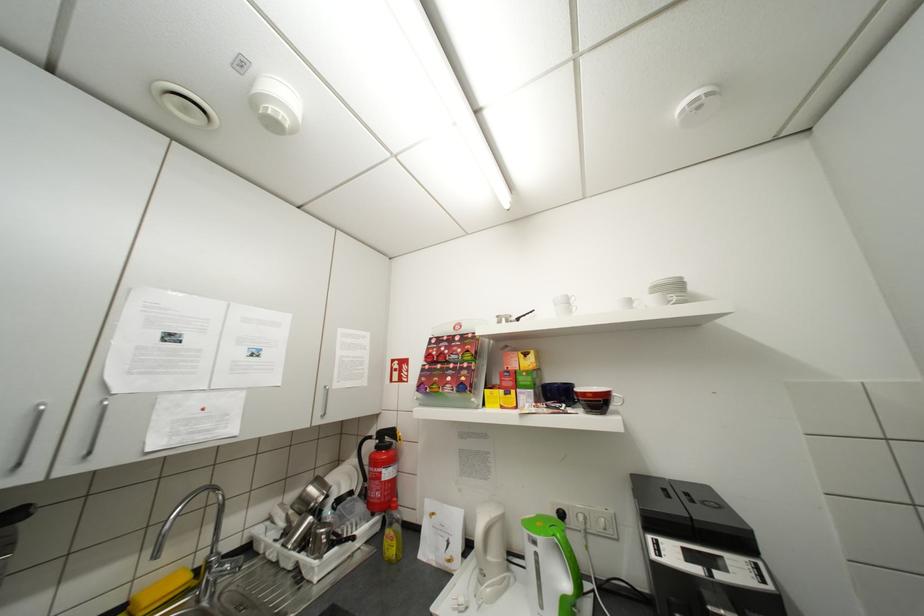
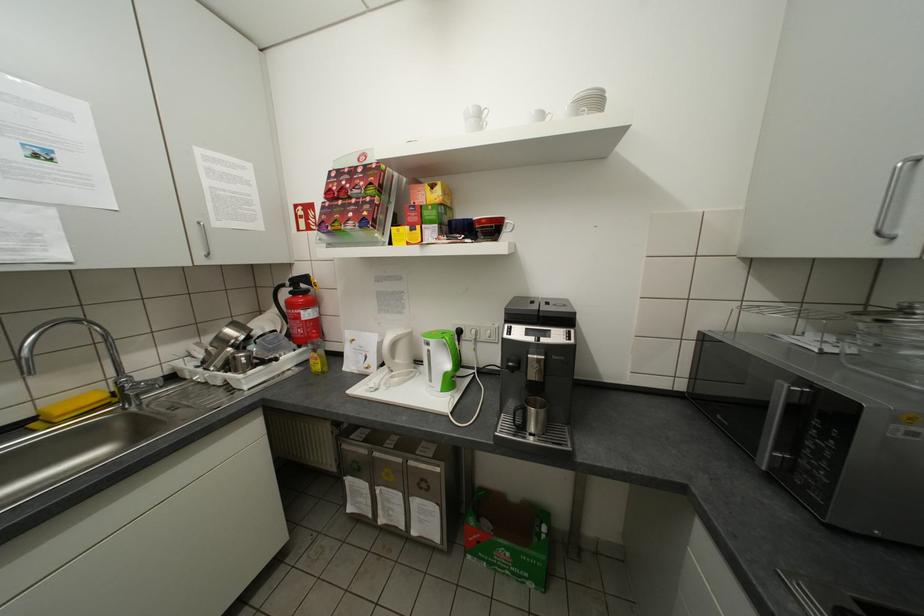
Locate, in the second image, the point that corresponds to point 327,414 in the first image.

(209, 253)